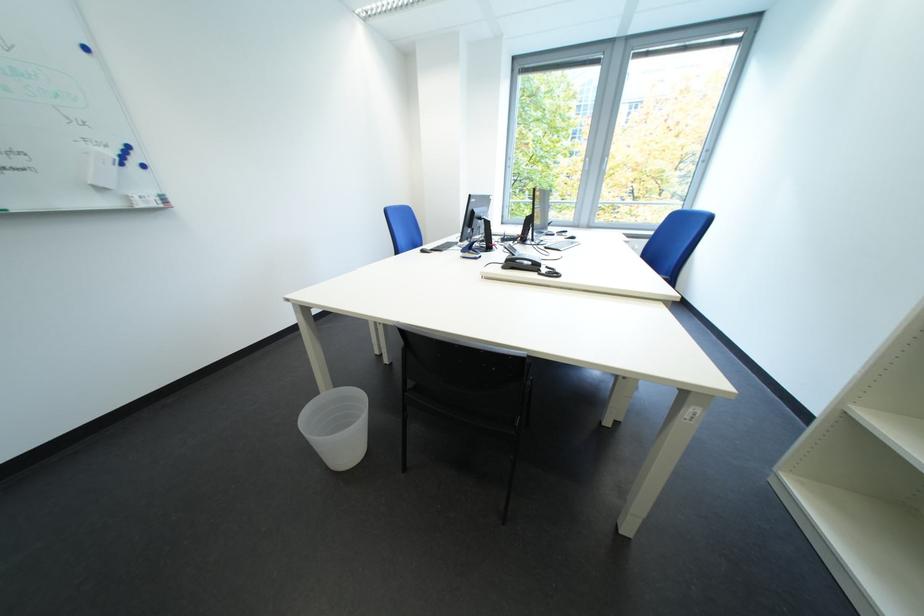
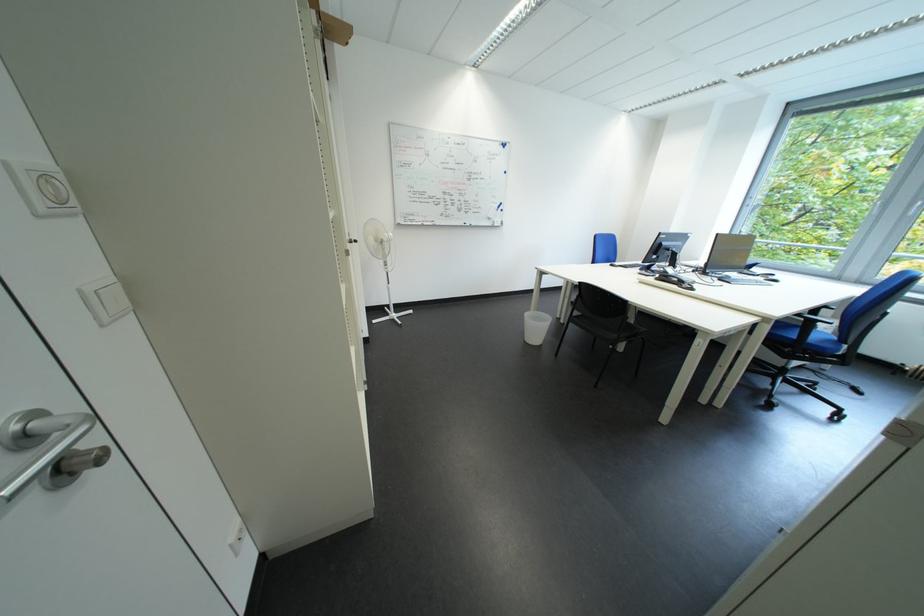
Locate, in the second image, the point that corresponds to the point at 516,270 in the first image.

(669, 282)